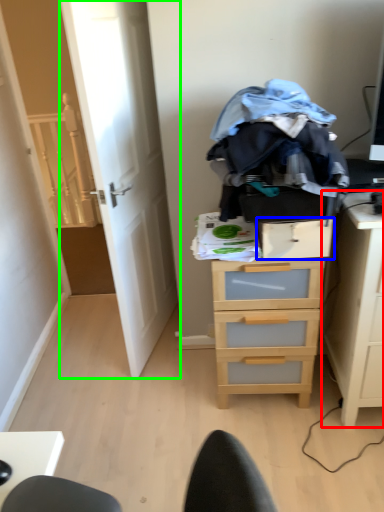
Question: Which object is positioned closest to nightstand (highlighted by a red box)? Select from drawer (highlighted by a blue box) and door (highlighted by a green box).

Choices:
 (A) drawer
 (B) door

Answer: (A)